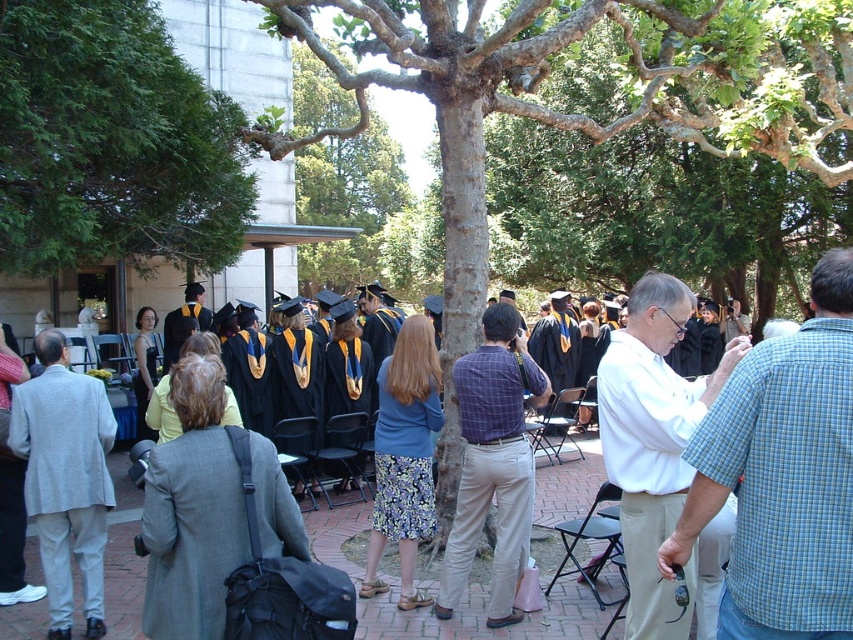
You are a photographer at the graduation ceremony. You need to capture a photo where both the gray wool coat at center and the matte black graduation gown at center are visible. Considering their heights, which one might appear taller in the photo?

The gray wool coat at center is taller than the matte black graduation gown at center, so it will appear taller in the photo.

You are a photographer at the graduation ceremony. You want to take a photo that includes both the white shirt at center and graduation gown at center. Which one should you focus on first if you want to ensure both are in the frame?

The white shirt at center is below graduation gown at center, so you should focus on the graduation gown at center first to ensure both are in the frame.